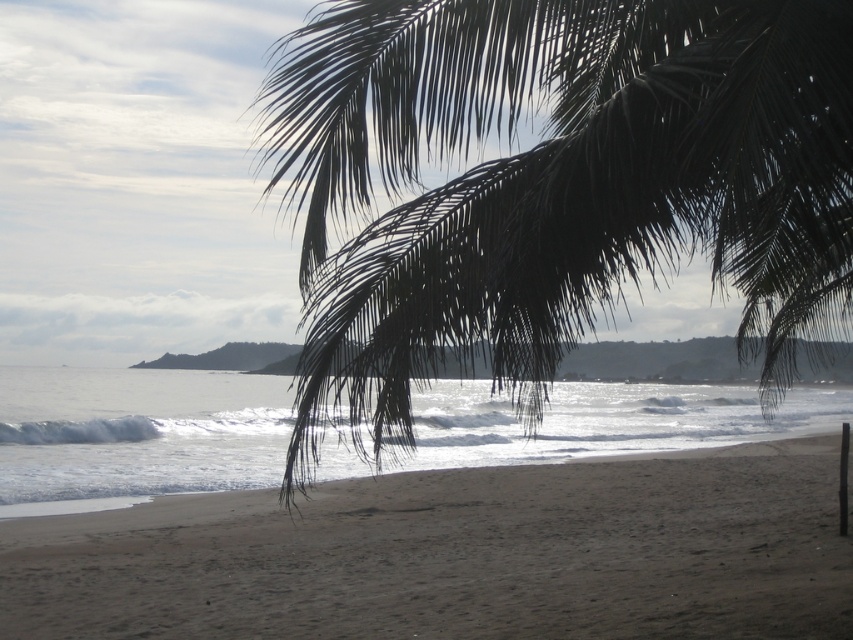
Does green leafy palm tree at upper right have a greater width compared to dark brown sand at lower center?

Incorrect, green leafy palm tree at upper right's width does not surpass dark brown sand at lower center's.

Does green leafy palm tree at upper right have a lesser height compared to dark brown sand at lower center?

No.

Locate an element on the screen. This screenshot has width=853, height=640. green leafy palm tree at upper right is located at coordinates (555, 182).

Locate an element on the screen. This screenshot has width=853, height=640. green leafy palm tree at upper right is located at coordinates (555, 182).